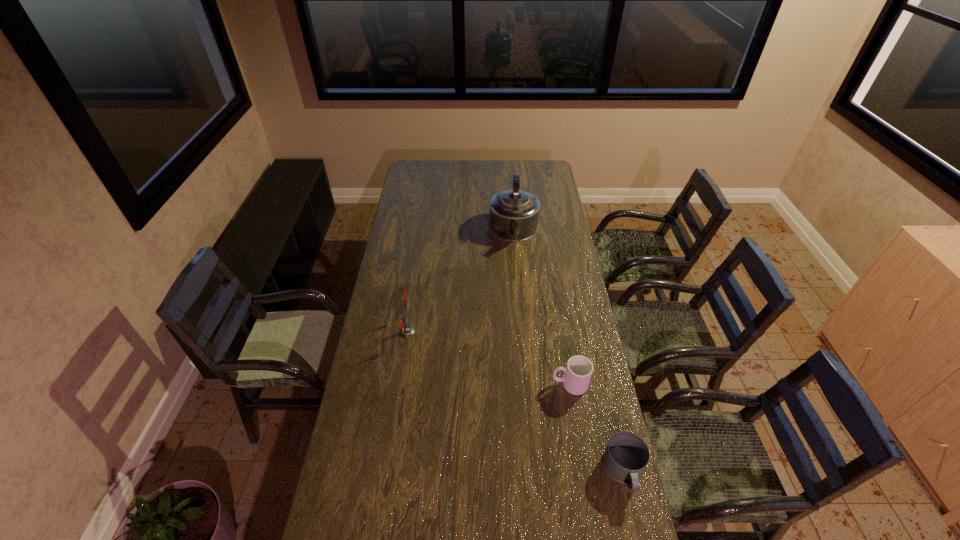
Find the location of `vacant area situated with the spout at the front of the tallest object`. vacant area situated with the spout at the front of the tallest object is located at coordinates (515, 264).

The image size is (960, 540). What are the coordinates of `free space located with the spout at the front of the tallest object` in the screenshot? It's located at (515, 265).

Locate an element on the screen. The image size is (960, 540). vacant space located 0.110m with the handle on the side of the second shortest object is located at coordinates (521, 382).

Where is `free location located with the handle on the side of the second shortest object`? This screenshot has height=540, width=960. free location located with the handle on the side of the second shortest object is located at coordinates (499, 380).

Locate an element on the screen. The width and height of the screenshot is (960, 540). vacant space located 0.260m with the handle on the side of the second shortest object is located at coordinates (481, 379).

The image size is (960, 540). What are the coordinates of `object that is at the left edge` in the screenshot? It's located at (405, 331).

You are a GUI agent. You are given a task and a screenshot of the screen. Output one action in this format:
    pyautogui.click(x=<x>, y=<y>)
    Task: Click on the mug that is at the right edge
    The height and width of the screenshot is (540, 960).
    Given the screenshot: What is the action you would take?
    pyautogui.click(x=626, y=456)

The width and height of the screenshot is (960, 540). In order to click on kettle present at the right edge in this screenshot , I will do `click(513, 214)`.

I want to click on cup that is at the right edge, so click(578, 371).

The width and height of the screenshot is (960, 540). I want to click on vacant space at the far edge, so click(451, 170).